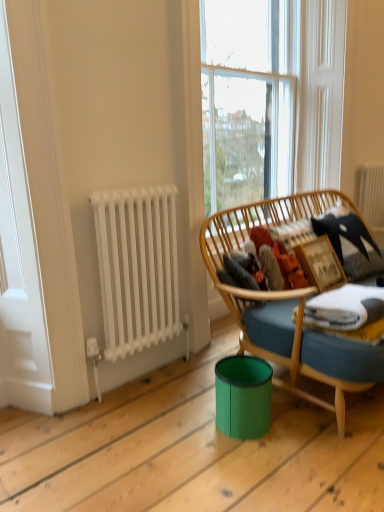
Question: From their relative heights in the image, would you say clear glass window at upper center is taller or shorter than fuzzy fabric at center?

Choices:
 (A) tall
 (B) short

Answer: (A)

Question: Considering their positions, is clear glass window at upper center located in front of or behind fuzzy fabric at center?

Choices:
 (A) front
 (B) behind

Answer: (A)

Question: Which is nearer to the white matte radiator at left?

Choices:
 (A) white metallic radiator at left, the 1th radiator positioned from the left
 (B) green plastic trash bin at lower center
 (C) clear glass window at upper center
 (D) white metal radiator at upper right, which appears as the 2th radiator when viewed from the left
 (E) fuzzy fabric at center

Answer: (A)

Question: Considering the real-world distances, which object is closest to the white matte radiator at left?

Choices:
 (A) green plastic trash bin at lower center
 (B) fuzzy fabric at center
 (C) white metallic radiator at left, which appears as the second radiator when viewed from the right
 (D) clear glass window at upper center
 (E) white metal radiator at upper right, which ranks as the 1th radiator in right-to-left order

Answer: (C)